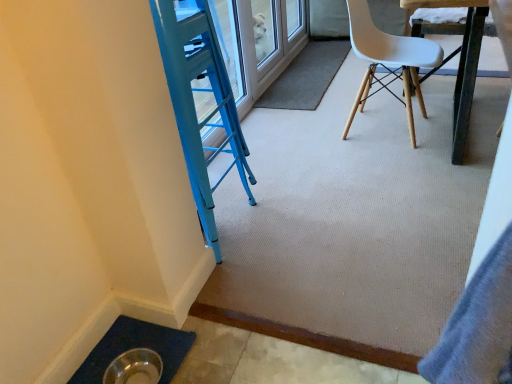
Question: Considering their positions, is white plastic chair at upper right located in front of or behind carpet at center?

Choices:
 (A) front
 (B) behind

Answer: (A)

Question: In terms of width, does white plastic chair at upper right look wider or thinner when compared to carpet at center?

Choices:
 (A) thin
 (B) wide

Answer: (B)

Question: Estimate the real-world distances between objects in this image. Which object is closer to the metallic dark brown table at upper right?

Choices:
 (A) white plastic chair at upper right
 (B) carpet at center

Answer: (A)

Question: Based on their relative distances, which object is farther from the white plastic chair at upper right?

Choices:
 (A) metallic dark brown table at upper right
 (B) carpet at center

Answer: (B)